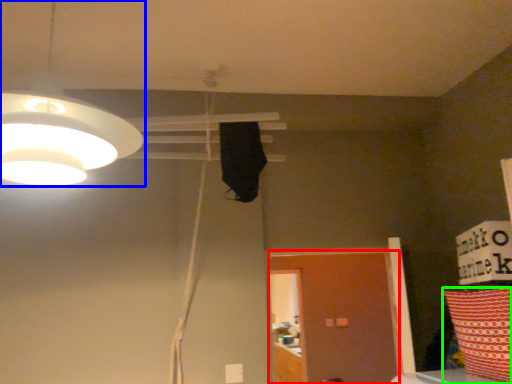
Question: Based on their relative distances, which object is farther from door (highlighted by a red box)? Choose from lamp (highlighted by a blue box) and pillow (highlighted by a green box).

Choices:
 (A) lamp
 (B) pillow

Answer: (A)